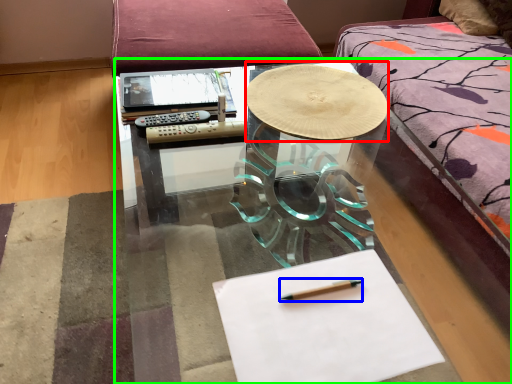
Question: Based on their relative distances, which object is farther from round table (highlighted by a red box)? Choose from pencil (highlighted by a blue box) and table (highlighted by a green box).

Choices:
 (A) pencil
 (B) table

Answer: (A)